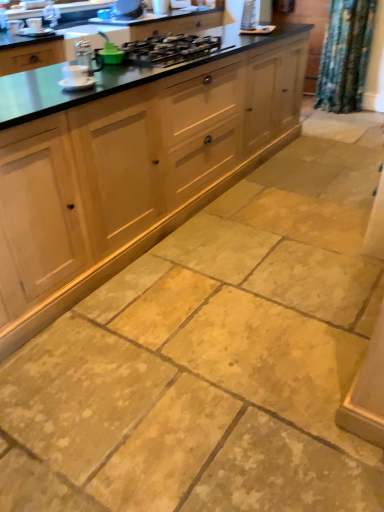
This screenshot has height=512, width=384. Identify the location of free space in front of green plastic brush at upper center, which is the 2th appliance in right-to-left order. (122, 71).